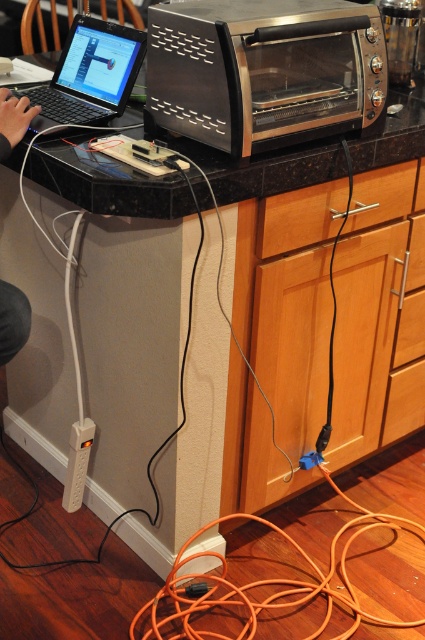
Does point (87, 17) come farther from viewer compared to point (67, 476)?

No, it is not.

Does point (56, 92) come closer to viewer compared to point (82, 452)?

Yes, point (56, 92) is closer to viewer.

Identify the location of matte black laptop at left. (x=88, y=76).

Between black granite countertop at upper center and white plastic plug at lower left, which one appears on the right side from the viewer's perspective?

black granite countertop at upper center

Does black granite countertop at upper center have a lesser height compared to white plastic plug at lower left?

No.

Is point (401, 157) positioned before point (84, 481)?

Yes, it is in front of point (84, 481).

What are the coordinates of `black granite countertop at upper center` in the screenshot? It's located at (104, 182).

Can you confirm if black granite countertop at upper center is taller than skinny jeans at lower left?

Indeed, black granite countertop at upper center has a greater height compared to skinny jeans at lower left.

Describe the element at coordinates (104, 182) in the screenshot. I see `black granite countertop at upper center` at that location.

Is point (342, 172) closer to camera compared to point (0, 320)?

No, it is not.

Identify the location of black granite countertop at upper center. (104, 182).